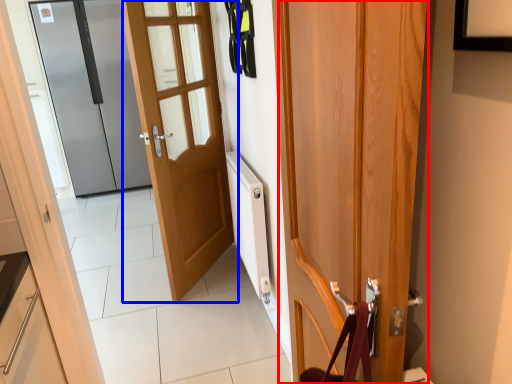
Question: Which object appears closest to the camera in this image, door (highlighted by a red box) or door (highlighted by a blue box)?

Choices:
 (A) door
 (B) door

Answer: (A)